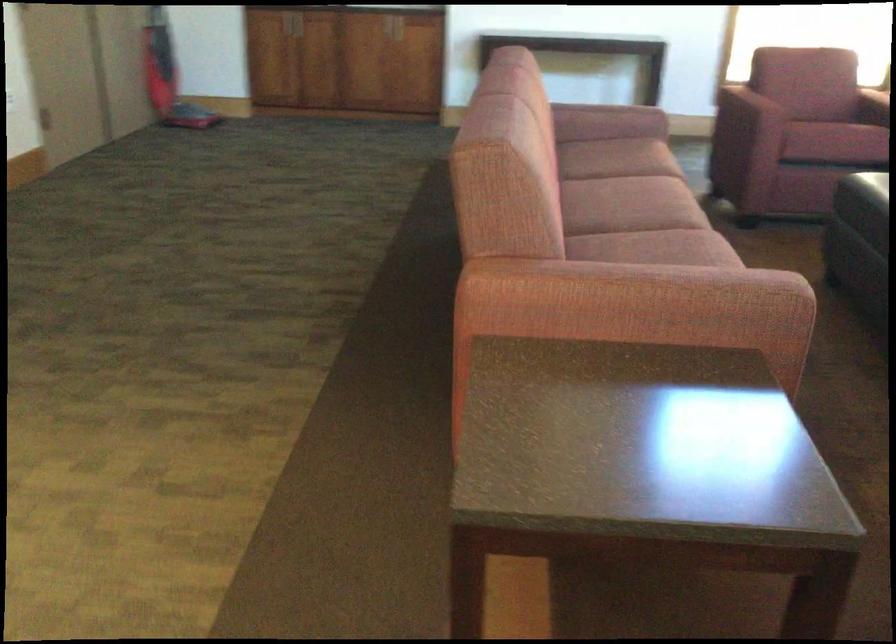
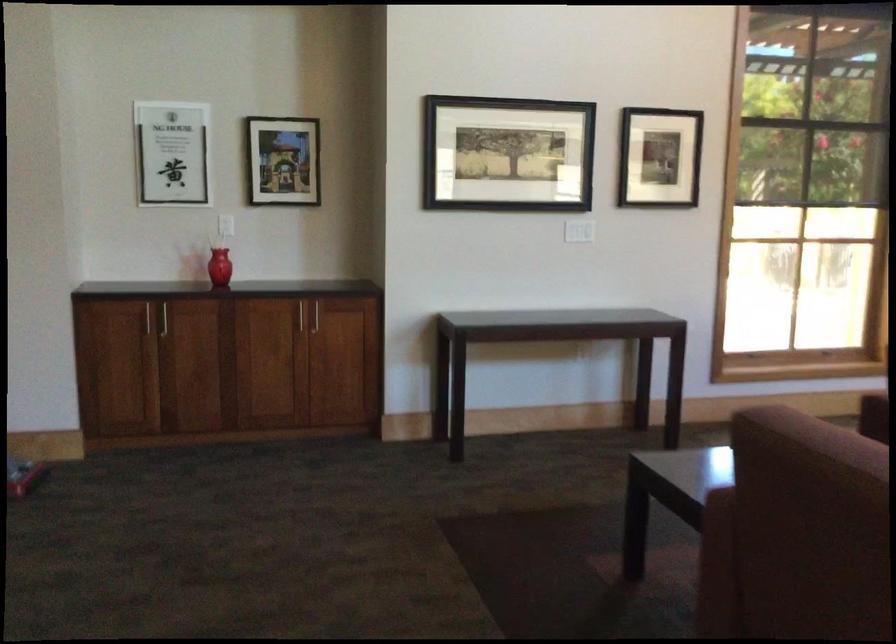
In a continuous first-person perspective shot, in which direction is the camera moving?

The movement direction of the cameraman is left, forward.